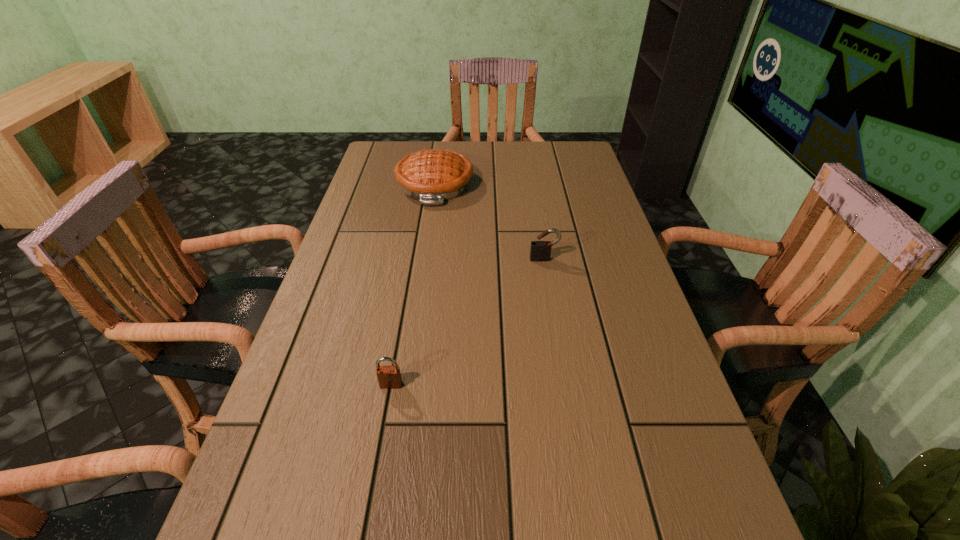
In order to click on object present at the far left corner in this screenshot , I will do `click(432, 176)`.

Identify the location of blank space at the far edge of the desktop. (540, 162).

In the image, there is a desktop. At what (x,y) coordinates should I click in order to perform the action: click on vacant region at the left edge. Please return your answer as a coordinate pair (x, y). Looking at the image, I should click on (366, 256).

Locate an element on the screen. The width and height of the screenshot is (960, 540). free region at the right edge of the desktop is located at coordinates (618, 287).

Image resolution: width=960 pixels, height=540 pixels. Find the location of `free space at the far left corner of the desktop`. free space at the far left corner of the desktop is located at coordinates (392, 146).

This screenshot has height=540, width=960. In the image, there is a desktop. Identify the location of free space at the far right corner. (562, 151).

Image resolution: width=960 pixels, height=540 pixels. Find the location of `empty space that is in between the pie and the second nearest object`. empty space that is in between the pie and the second nearest object is located at coordinates (490, 221).

At what (x,y) coordinates should I click in order to perform the action: click on empty space between the farthest object and the left padlock. Please return your answer as a coordinate pair (x, y). This screenshot has width=960, height=540. Looking at the image, I should click on (413, 285).

Locate an element on the screen. free point between the pie and the nearest object is located at coordinates (413, 285).

At what (x,y) coordinates should I click in order to perform the action: click on free spot between the nearest object and the right padlock. Please return your answer as a coordinate pair (x, y). The width and height of the screenshot is (960, 540). Looking at the image, I should click on [x=468, y=322].